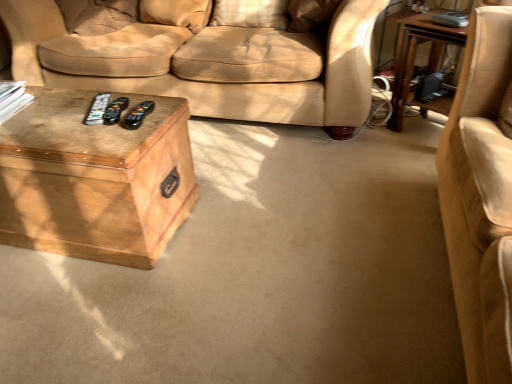
Question: Considering the relative sizes of black plastic remote at center, arranged as the 2th remote when viewed from the right, and black plastic remote at center, marked as the 3th remote in a right-to-left arrangement, in the image provided, is black plastic remote at center, arranged as the 2th remote when viewed from the right, bigger than black plastic remote at center, marked as the 3th remote in a right-to-left arrangement,?

Choices:
 (A) yes
 (B) no

Answer: (A)

Question: Is black plastic remote at center, the 2th remote viewed from the left, far from black plastic remote at center, marked as the 3th remote in a right-to-left arrangement?

Choices:
 (A) yes
 (B) no

Answer: (B)

Question: From the image's perspective, is black plastic remote at center, arranged as the 2th remote when viewed from the right, below black plastic remote at center, the 1th remote in the left-to-right sequence?

Choices:
 (A) yes
 (B) no

Answer: (A)

Question: Considering the relative sizes of black plastic remote at center, the 2th remote viewed from the left, and black plastic remote at center, the 1th remote in the left-to-right sequence, in the image provided, is black plastic remote at center, the 2th remote viewed from the left, taller than black plastic remote at center, the 1th remote in the left-to-right sequence,?

Choices:
 (A) yes
 (B) no

Answer: (A)

Question: Considering the relative sizes of black plastic remote at center, the 2th remote viewed from the left, and black plastic remote at center, marked as the 3th remote in a right-to-left arrangement, in the image provided, is black plastic remote at center, the 2th remote viewed from the left, thinner than black plastic remote at center, marked as the 3th remote in a right-to-left arrangement,?

Choices:
 (A) no
 (B) yes

Answer: (B)

Question: Is black plastic remote at center, the 1th remote in the left-to-right sequence, inside black plastic remote at center, the 2th remote viewed from the left?

Choices:
 (A) no
 (B) yes

Answer: (A)

Question: Is wooden trunk at lower left, which is the second table in right-to-left order, to the right of wooden table at right, the second table when ordered from left to right, from the viewer's perspective?

Choices:
 (A) yes
 (B) no

Answer: (B)

Question: Is wooden trunk at lower left, acting as the first table starting from the left, bigger than wooden table at right, the second table when ordered from left to right?

Choices:
 (A) no
 (B) yes

Answer: (B)

Question: From a real-world perspective, is wooden trunk at lower left, which is the second table in right-to-left order, positioned over wooden table at right, arranged as the first table when viewed from the right, based on gravity?

Choices:
 (A) yes
 (B) no

Answer: (B)

Question: Is wooden trunk at lower left, acting as the first table starting from the left, facing towards wooden table at right, arranged as the first table when viewed from the right?

Choices:
 (A) no
 (B) yes

Answer: (A)

Question: Is wooden trunk at lower left, acting as the first table starting from the left, beside wooden table at right, the second table when ordered from left to right?

Choices:
 (A) yes
 (B) no

Answer: (B)

Question: From the image's perspective, does wooden trunk at lower left, which is the second table in right-to-left order, appear lower than wooden table at right, the second table when ordered from left to right?

Choices:
 (A) no
 (B) yes

Answer: (B)

Question: From a real-world perspective, does black plastic remote at center, marked as the 3th remote in a right-to-left arrangement, sit lower than black plastic remote at center, arranged as the 2th remote when viewed from the right?

Choices:
 (A) no
 (B) yes

Answer: (B)